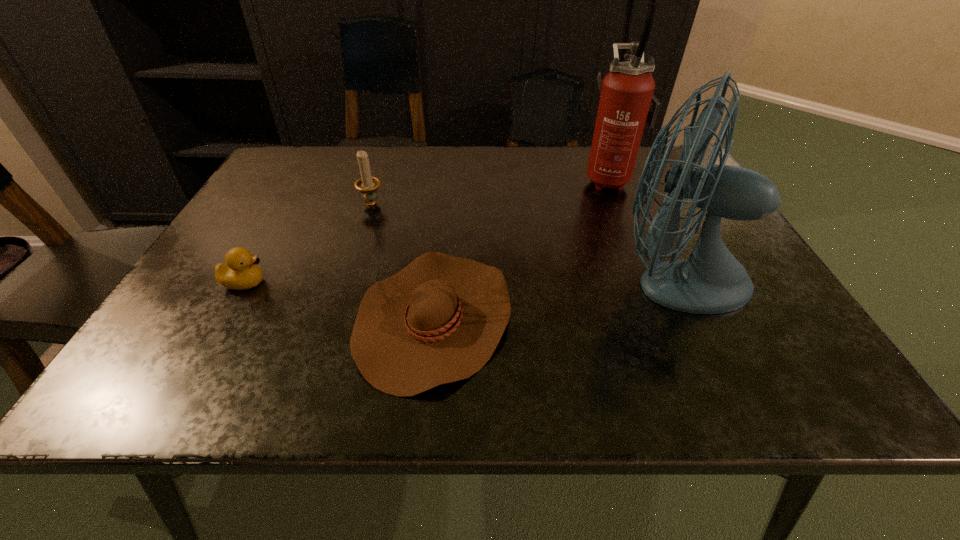
Find the location of a particular element. This screenshot has height=540, width=960. free spot between the fire extinguisher and the cowboy hat is located at coordinates (521, 248).

Where is `blank region between the shortest object and the fan`? blank region between the shortest object and the fan is located at coordinates (554, 298).

You are a GUI agent. You are given a task and a screenshot of the screen. Output one action in this format:
    pyautogui.click(x=<x>, y=<y>)
    Task: Click on the vacant area that lies between the fourth shortest object and the candle_holder
    The image size is (960, 540).
    Given the screenshot: What is the action you would take?
    pyautogui.click(x=522, y=242)

Find the location of a particular element. This screenshot has height=540, width=960. empty space between the fire extinguisher and the candle_holder is located at coordinates (490, 192).

Where is `vacant area that lies between the fan and the second farthest object`? This screenshot has height=540, width=960. vacant area that lies between the fan and the second farthest object is located at coordinates (522, 242).

Identify the location of free spot between the third object from right to left and the candle_holder. pos(402,261).

This screenshot has height=540, width=960. Find the location of `object that ranks as the third closest to the farthest object`. object that ranks as the third closest to the farthest object is located at coordinates (367, 185).

This screenshot has width=960, height=540. In order to click on object that is the fourth closest one to the shortest object in this screenshot , I will do `click(627, 101)`.

At what (x,y) coordinates should I click in order to perform the action: click on vacant space that satisfies the following two spatial constraints: 1. on the handle side of the fourth object from right to left; 2. on the face of the second shortest object. Please return your answer as a coordinate pair (x, y). Looking at the image, I should click on (346, 282).

You are a GUI agent. You are given a task and a screenshot of the screen. Output one action in this format:
    pyautogui.click(x=<x>, y=<y>)
    Task: Click on the free space that satisfies the following two spatial constraints: 1. on the face of the second shortest object; 2. on the back side of the third object from right to left
    
    Given the screenshot: What is the action you would take?
    [x=226, y=317]